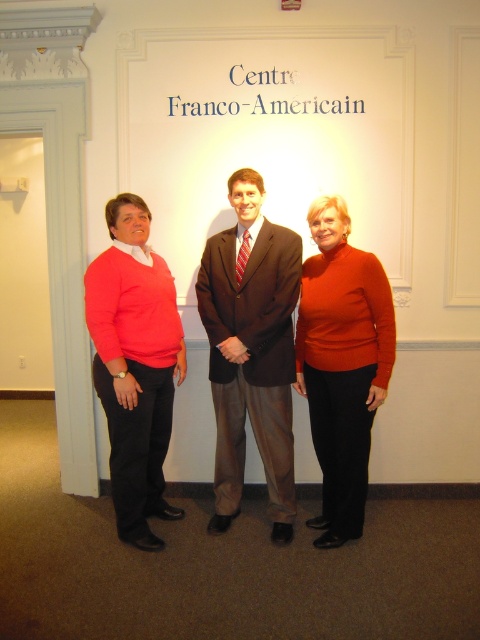
Between matte coral sweater at left and matte orange sweater at center, which one has less height?

With less height is matte orange sweater at center.

Is matte coral sweater at left shorter than matte orange sweater at center?

No.

Between point (127, 358) and point (370, 337), which one is positioned behind?

Positioned behind is point (370, 337).

I want to click on matte coral sweater at left, so pyautogui.click(x=134, y=364).

Can you confirm if matte brown suit at center is positioned above matte orange sweater at center?

Yes.

Who is lower down, matte brown suit at center or matte orange sweater at center?

matte orange sweater at center is below.

Describe the element at coordinates (251, 349) in the screenshot. This screenshot has width=480, height=640. I see `matte brown suit at center` at that location.

Locate an element on the screen. The height and width of the screenshot is (640, 480). matte brown suit at center is located at coordinates (251, 349).

Which is more to the left, matte brown suit at center or matte coral sweater at left?

Positioned to the left is matte coral sweater at left.

Based on the photo, can you confirm if matte brown suit at center is wider than matte coral sweater at left?

Yes, matte brown suit at center is wider than matte coral sweater at left.

Locate an element on the screen. matte brown suit at center is located at coordinates (251, 349).